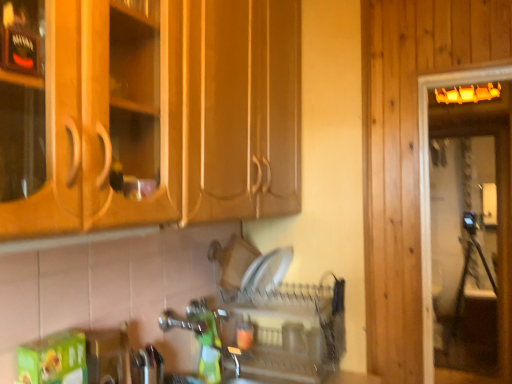
Question: Does transparent glass screen door at right lie behind clear plastic dish rack at center?

Choices:
 (A) yes
 (B) no

Answer: (A)

Question: Is transparent glass screen door at right taller than clear plastic dish rack at center?

Choices:
 (A) no
 (B) yes

Answer: (B)

Question: Considering the relative sizes of transparent glass screen door at right and clear plastic dish rack at center in the image provided, is transparent glass screen door at right smaller than clear plastic dish rack at center?

Choices:
 (A) no
 (B) yes

Answer: (A)

Question: From the image's perspective, is transparent glass screen door at right on top of clear plastic dish rack at center?

Choices:
 (A) no
 (B) yes

Answer: (B)

Question: From the image's perspective, does transparent glass screen door at right appear lower than clear plastic dish rack at center?

Choices:
 (A) no
 (B) yes

Answer: (A)

Question: Can you confirm if transparent glass screen door at right is positioned to the right of clear plastic dish rack at center?

Choices:
 (A) yes
 (B) no

Answer: (A)

Question: From a real-world perspective, is clear plastic dish rack at center below transparent glass screen door at right?

Choices:
 (A) no
 (B) yes

Answer: (B)

Question: Is clear plastic dish rack at center positioned with its back to transparent glass screen door at right?

Choices:
 (A) yes
 (B) no

Answer: (A)

Question: Considering the relative sizes of clear plastic dish rack at center and transparent glass screen door at right in the image provided, is clear plastic dish rack at center smaller than transparent glass screen door at right?

Choices:
 (A) yes
 (B) no

Answer: (A)

Question: Does clear plastic dish rack at center contain transparent glass screen door at right?

Choices:
 (A) yes
 (B) no

Answer: (B)

Question: Is clear plastic dish rack at center not within transparent glass screen door at right?

Choices:
 (A) no
 (B) yes

Answer: (B)

Question: From a real-world perspective, is clear plastic dish rack at center on transparent glass screen door at right?

Choices:
 (A) yes
 (B) no

Answer: (B)

Question: Is clear plastic dish rack at center wider or thinner than transparent glass screen door at right?

Choices:
 (A) thin
 (B) wide

Answer: (B)